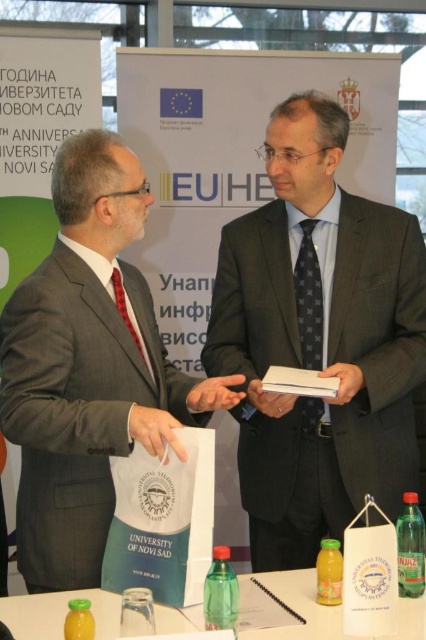
Is dark gray suit at center positioned at the back of green plastic bottle at center?

Yes, dark gray suit at center is behind green plastic bottle at center.

Can you confirm if dark gray suit at center is positioned above green plastic bottle at center?

Yes, dark gray suit at center is above green plastic bottle at center.

Which is in front, point (362, 448) or point (229, 580)?

Point (229, 580)

The height and width of the screenshot is (640, 426). What are the coordinates of `dark gray suit at center` in the screenshot? It's located at (319, 339).

Which is below, translucent plastic bottle at lower center or translucent plastic bottle at lower left?

translucent plastic bottle at lower left

Looking at this image, is translucent plastic bottle at lower center positioned in front of translucent plastic bottle at lower left?

No, translucent plastic bottle at lower center is further to the viewer.

Find the location of a particular element. The image size is (426, 640). translucent plastic bottle at lower center is located at coordinates (328, 572).

Does matte white book at center have a lesser width compared to translucent plastic bottle at lower left?

No.

Is matte white book at center taller than translucent plastic bottle at lower left?

Correct, matte white book at center is much taller as translucent plastic bottle at lower left.

Is point (328, 369) farther from viewer compared to point (75, 637)?

Yes, point (328, 369) is farther from viewer.

Locate an element on the screen. The height and width of the screenshot is (640, 426). matte white book at center is located at coordinates (344, 381).